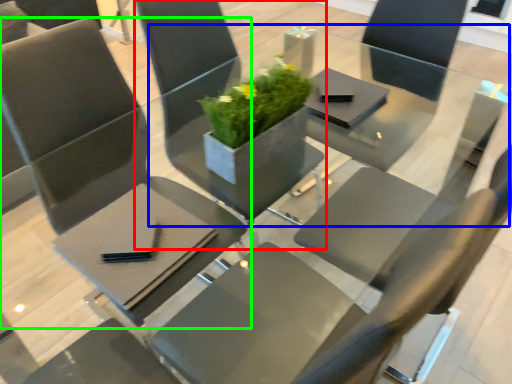
Question: Which object is positioned closest to chair (highlighted by a red box)? Select from round table (highlighted by a blue box) and chair (highlighted by a green box).

Choices:
 (A) round table
 (B) chair

Answer: (B)